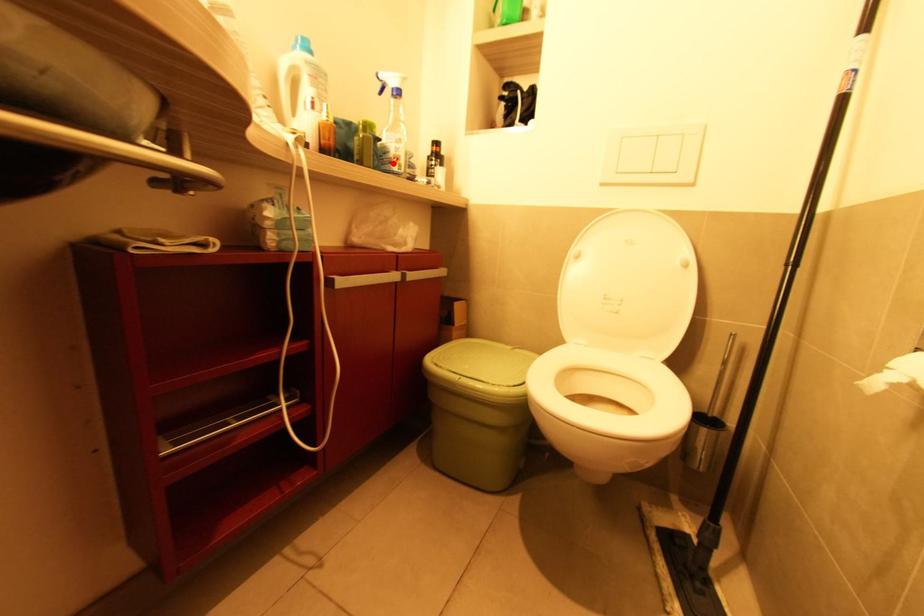
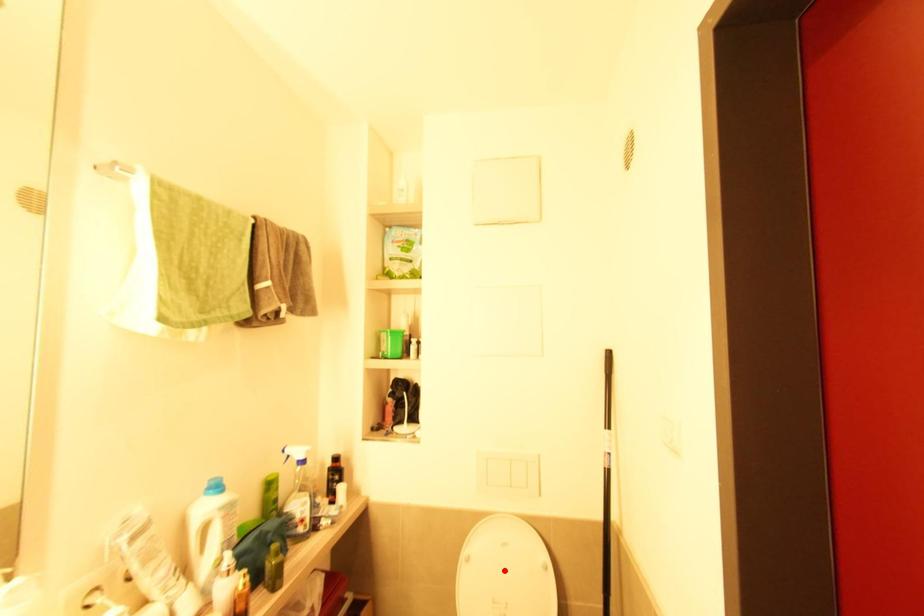
I am providing you with two images of the same scene from different viewpoints. A red point is marked on the first image and another point is marked on the second image. Are the points marked in image1 and image2 representing the same 3D position?

No